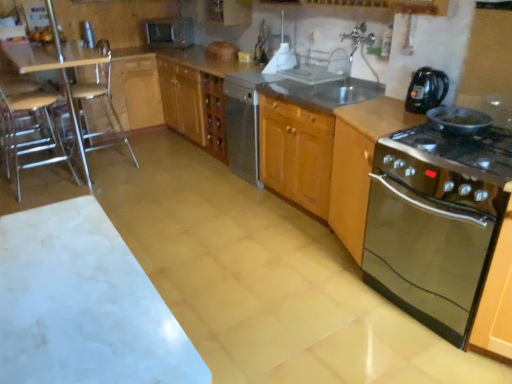
Identify the location of vacant area that lies between clear plastic bar stool at left, the first bar stool viewed from the right, and black stainless steel oven at right, marked as the 1th cabinetry in a front-to-back arrangement. This screenshot has height=384, width=512. (220, 221).